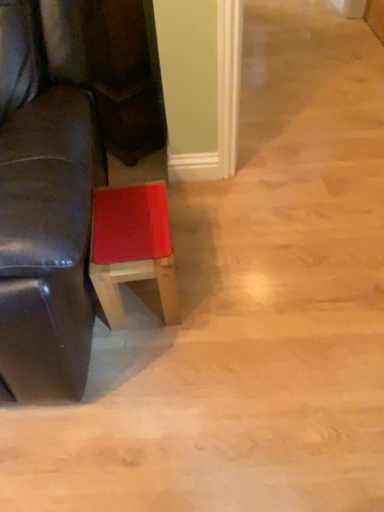
What is the approximate height of matte red stool at lower center?

The height of matte red stool at lower center is 13.43 inches.

The image size is (384, 512). Find the location of `matte red stool at lower center`. matte red stool at lower center is located at coordinates (132, 247).

The height and width of the screenshot is (512, 384). Describe the element at coordinates (132, 247) in the screenshot. I see `matte red stool at lower center` at that location.

In order to face matte red stool at lower center, should I rotate leftwards or rightwards?

Rotate your view left by about 7.588°.

You are a GUI agent. You are given a task and a screenshot of the screen. Output one action in this format:
    pyautogui.click(x=<x>, y=<y>)
    Task: Click on the matte red stool at lower center
    Image resolution: width=384 pixels, height=512 pixels.
    Given the screenshot: What is the action you would take?
    pyautogui.click(x=132, y=247)